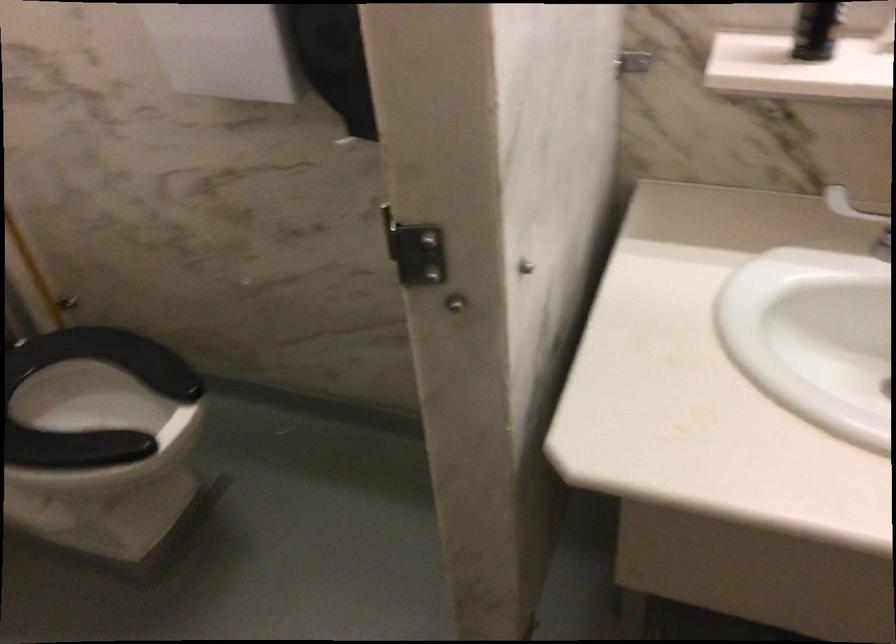
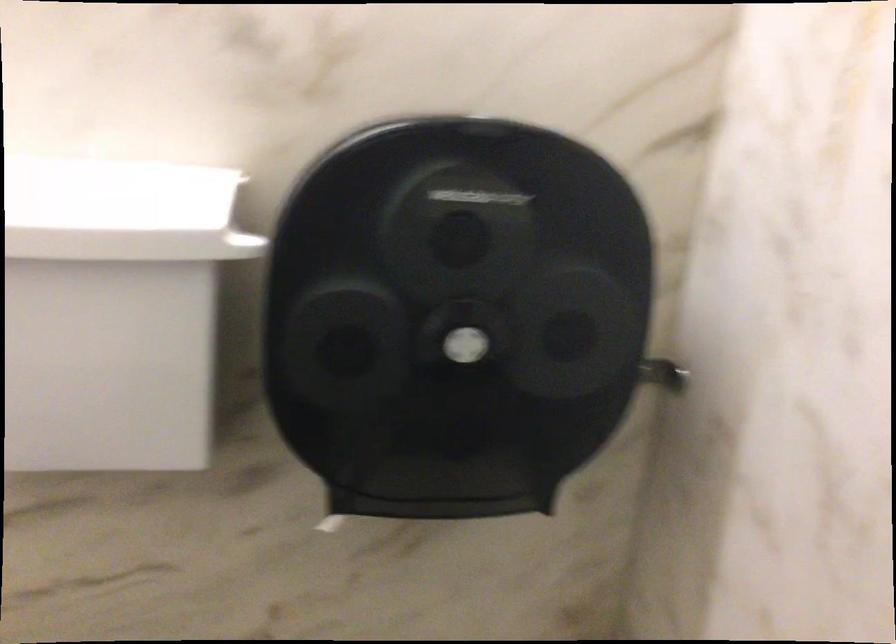
How did the camera likely rotate?

The camera's rotation is toward right-up.